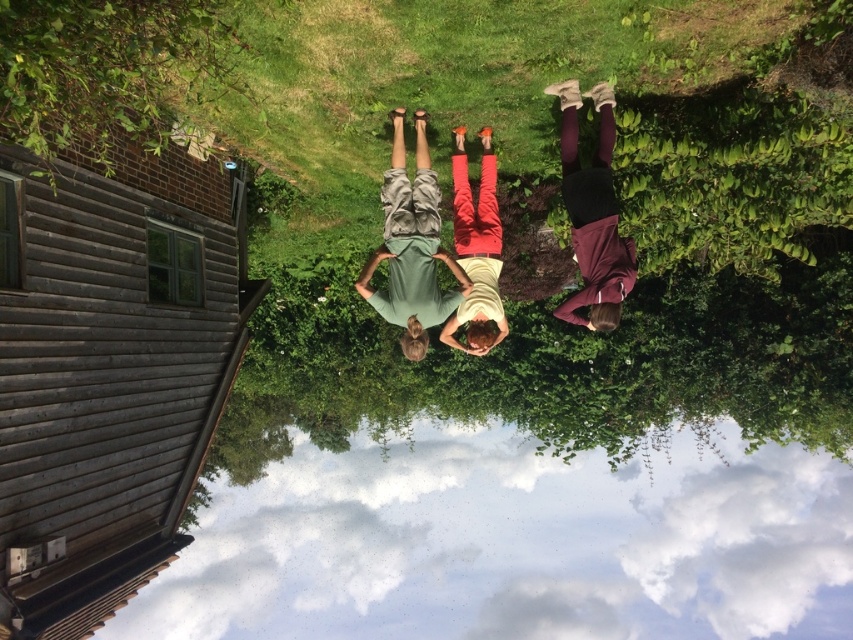
You are a delivery person trying to place a small package between the transparent glass water at lower center and the maroon fabric pants at center. Can you fit the package there?

The transparent glass water at lower center might be wider than maroon fabric pants at center, so there could be enough space to fit the package between them.

You are a photographer trying to capture the scene from the original upright orientation. You notice the transparent glass water at lower center and the green cotton shirt at center. Which object would you adjust your camera focus to first if you want to ensure both are in focus?

The transparent glass water at lower center is located below the green cotton shirt at center. To ensure both are in focus, you should focus on the green cotton shirt at center first since it is closer to the camera, and the depth of field will naturally include the transparent glass water at lower center which is further away.